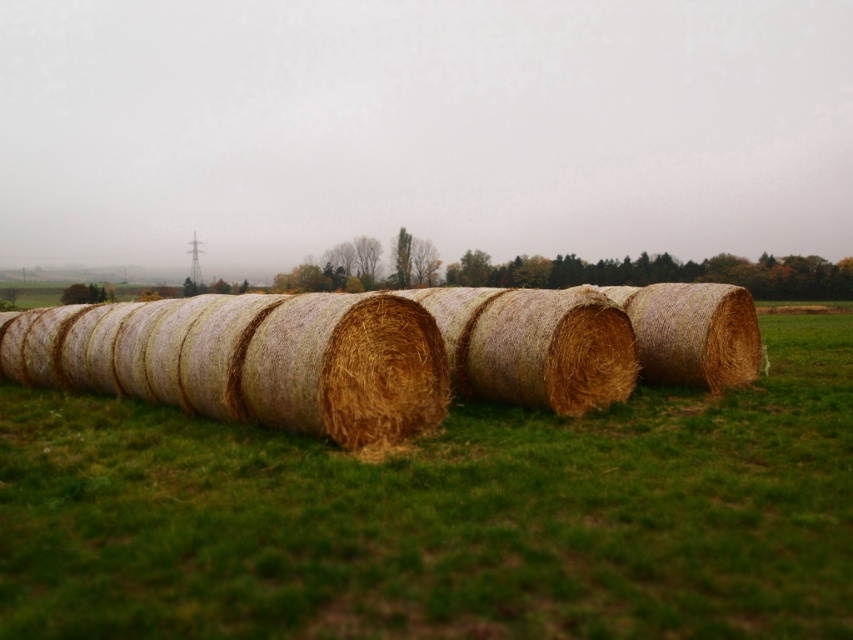
You are a gardener who wants to plant flowers between the green grass at center and the golden straw bales at center. Based on their positions, where should you place the flowers?

The green grass at center is below the golden straw bales at center, so you should plant the flowers between the green grass at center and the golden straw bales at center by placing them in the space below the golden straw bales at center where the green grass at center is located.

You are standing at the point marked as point (x=444, y=516) in the image. What is the immediate surface beneath your feet?

The immediate surface beneath your feet at point (x=444, y=516) is green grass at center.